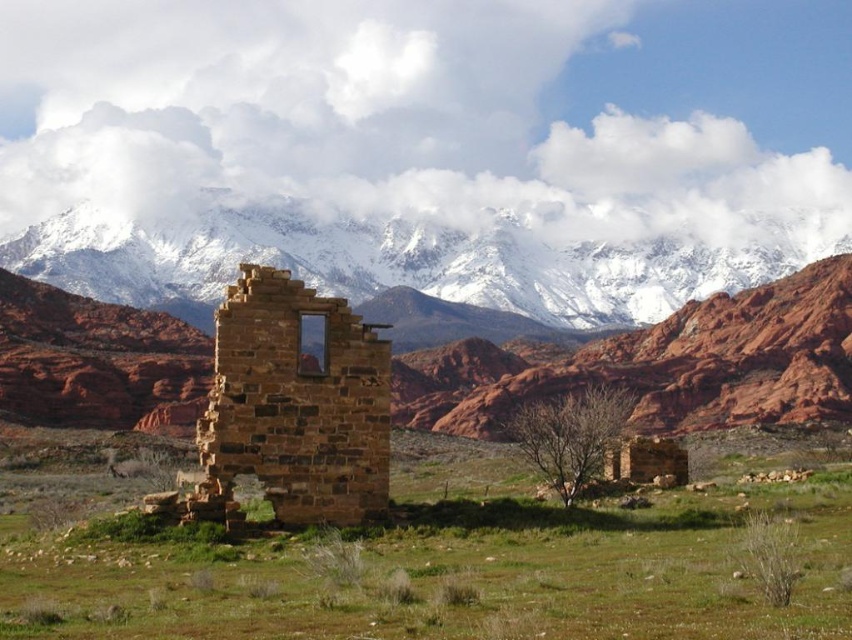
Between snowy granite mountain range at upper center and brown stone ruins at center, which one appears on the left side from the viewer's perspective?

From the viewer's perspective, brown stone ruins at center appears more on the left side.

Is point (205, 320) positioned after point (222, 428)?

Yes, point (205, 320) is farther from viewer.

Measure the distance between snowy granite mountain range at upper center and camera.

snowy granite mountain range at upper center and camera are 333.12 meters apart.

The image size is (852, 640). I want to click on snowy granite mountain range at upper center, so click(x=419, y=257).